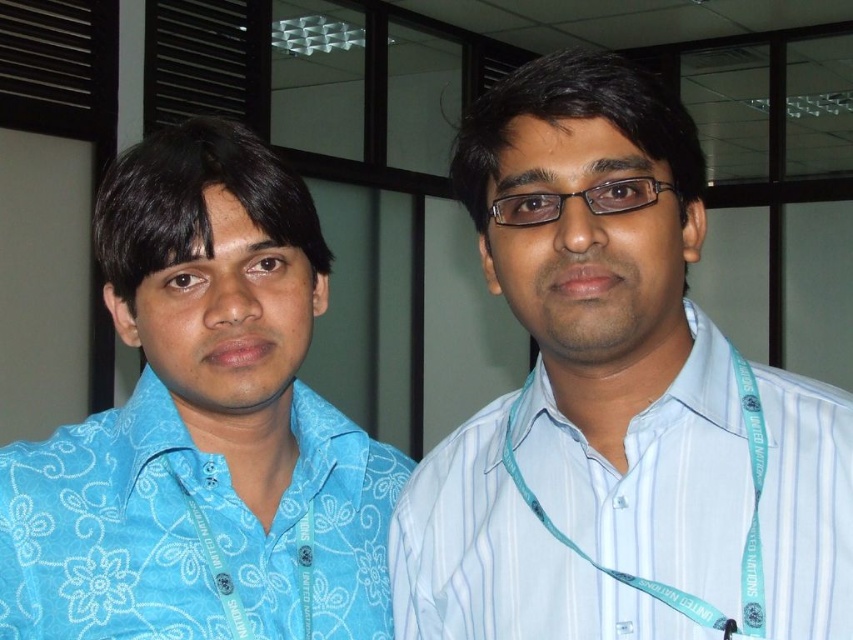
You are standing in an office and want to take a photo of the point at coordinates point (234,378). Your camera has a minimum focus distance of 30 inches. Will the camera be able to focus on the point?

The distance between point (234,378) and the camera is 30.73 inches, which is slightly beyond the camera minimum focus distance of 30 inches. Therefore, the camera might struggle to focus on the point unless you move closer.

You are an office security guard who needs to verify the height of two employees based on their shirts. The blue floral shirt at left and the white striped shirt at right are visible through the glass partition. Which shirt is taller?

The blue floral shirt at left is taller than the white striped shirt at right.

From the picture: You are a photographer setting up for a group photo. You need to ensure that the blue floral shirt at left and the white striped shirt at right are at least 10 inches apart for proper framing. Based on the scene description, can you confirm if their current distance meets this requirement?

The blue floral shirt at left is 9.39 inches away from the white striped shirt at right, which is less than the required 10 inches. Therefore, they are not currently at the required distance for proper framing.